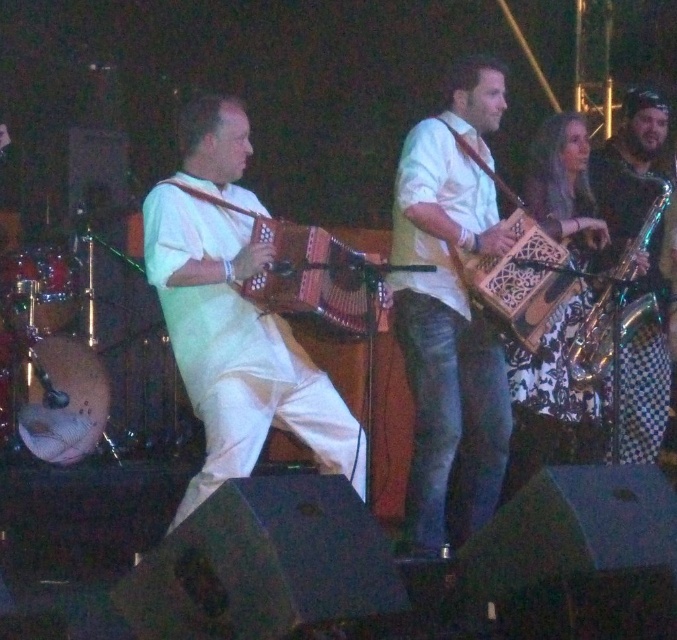
Which is behind, point (244, 268) or point (523, 304)?

Positioned behind is point (523, 304).

Does matte white accordion at center have a greater width compared to wooden carved accordion at center?

Yes.

Find the location of `matte white accordion at center`. matte white accordion at center is located at coordinates (236, 348).

The height and width of the screenshot is (640, 677). I want to click on matte white accordion at center, so coord(236,348).

Is matte wooden accordion at left positioned behind gold metallic saxophone at right?

No, it is not.

Can you confirm if matte wooden accordion at left is positioned to the left of gold metallic saxophone at right?

Indeed, matte wooden accordion at left is positioned on the left side of gold metallic saxophone at right.

This screenshot has height=640, width=677. Find the location of `matte wooden accordion at left`. matte wooden accordion at left is located at coordinates [x=311, y=275].

Locate an element on the screen. This screenshot has height=640, width=677. matte wooden accordion at left is located at coordinates (x=311, y=275).

Looking at this image, is matte white accordion at center to the left of gold metallic saxophone at right from the viewer's perspective?

Correct, you'll find matte white accordion at center to the left of gold metallic saxophone at right.

How much distance is there between matte white accordion at center and gold metallic saxophone at right?

A distance of 7.04 feet exists between matte white accordion at center and gold metallic saxophone at right.

You are a GUI agent. You are given a task and a screenshot of the screen. Output one action in this format:
    pyautogui.click(x=<x>, y=<y>)
    Task: Click on the matte white accordion at center
    The image size is (677, 640).
    Given the screenshot: What is the action you would take?
    pyautogui.click(x=236, y=348)